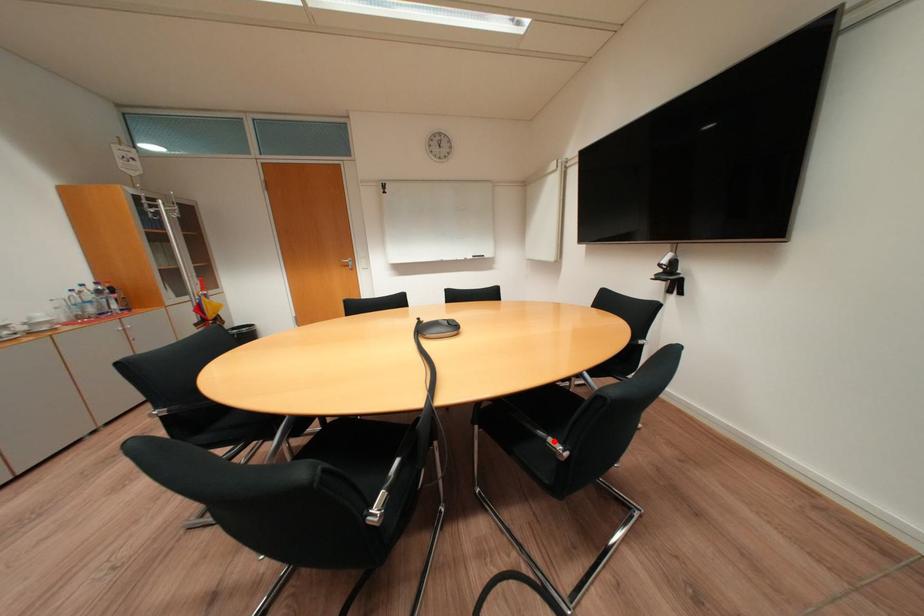
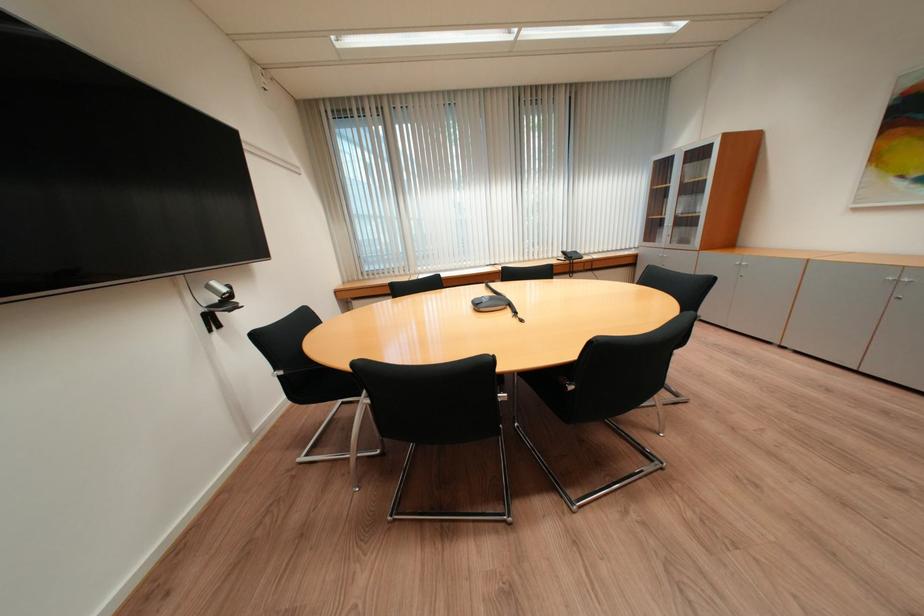
Question: I am providing you with two images of the same scene from different viewpoints. A red point is marked on the first image. Can you still see the location of the red point in image 2?

Choices:
 (A) Yes
 (B) No

Answer: (B)